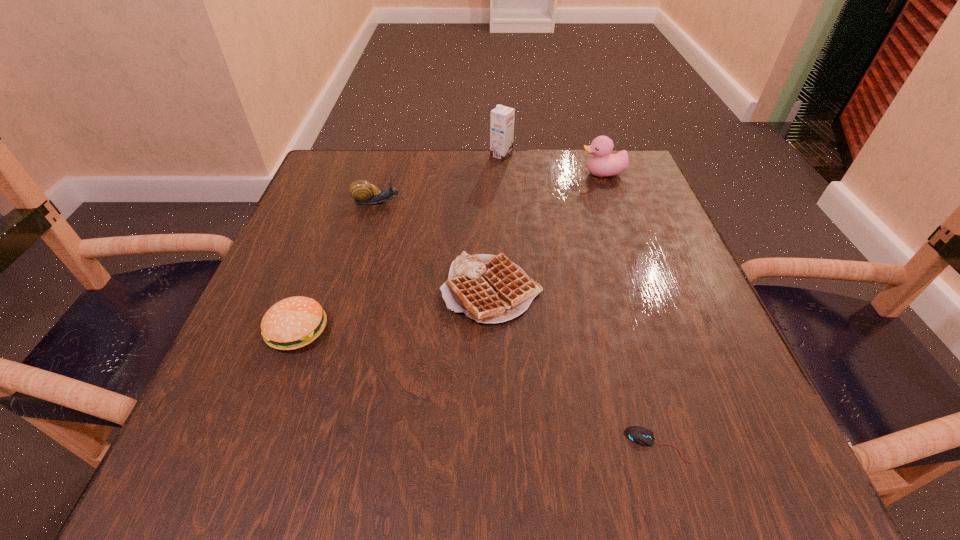
I want to click on escargot at the far edge, so click(363, 192).

Identify the location of object located at the near edge. Image resolution: width=960 pixels, height=540 pixels. (640, 435).

Image resolution: width=960 pixels, height=540 pixels. In order to click on escargot that is at the left edge in this screenshot , I will do `click(363, 192)`.

Find the location of a particular element. Image resolution: width=960 pixels, height=540 pixels. patty located in the left edge section of the desktop is located at coordinates (292, 323).

At what (x,y) coordinates should I click in order to perform the action: click on duckling positioned at the right edge. Please return your answer as a coordinate pair (x, y). Image resolution: width=960 pixels, height=540 pixels. Looking at the image, I should click on (603, 164).

Where is `mouse that is at the right edge`? mouse that is at the right edge is located at coordinates (640, 435).

Find the location of a particular element. This screenshot has height=540, width=960. object that is at the far left corner is located at coordinates (363, 192).

I want to click on object present at the far right corner, so click(x=603, y=164).

You are a GUI agent. You are given a task and a screenshot of the screen. Output one action in this format:
    pyautogui.click(x=<x>, y=<y>)
    Task: Click on the object present at the near right corner
    The height and width of the screenshot is (540, 960).
    Given the screenshot: What is the action you would take?
    pyautogui.click(x=640, y=435)

This screenshot has height=540, width=960. Find the location of `free space at the far edge`. free space at the far edge is located at coordinates (398, 156).